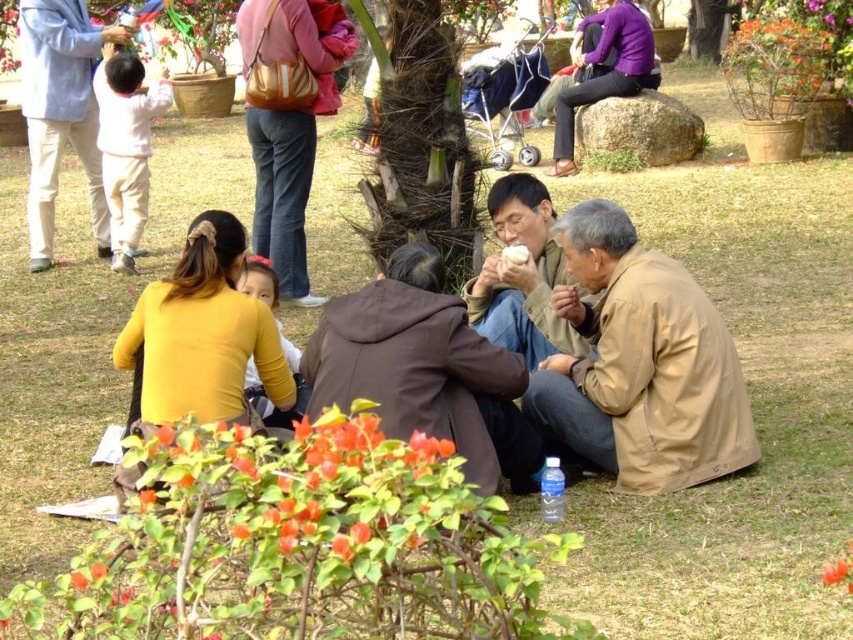
Between brown suede jacket at center and brown leather jacket at center, which one has less height?

With less height is brown leather jacket at center.

Locate an element on the screen. Image resolution: width=853 pixels, height=640 pixels. brown suede jacket at center is located at coordinates (424, 371).

Identify the location of brown suede jacket at center. (424, 371).

Measure the distance between brown textured tree trunk at center and pink fabric purse at upper center.

A distance of 1.67 meters exists between brown textured tree trunk at center and pink fabric purse at upper center.

Is point (407, 0) positioned before point (312, 29)?

Yes, point (407, 0) is closer to viewer.

Between point (357, 230) and point (280, 156), which one is positioned in front?

Point (357, 230) is more forward.

Where is `brown textured tree trunk at center`? brown textured tree trunk at center is located at coordinates (421, 141).

Where is `pink fabric purse at upper center`? The image size is (853, 640). pink fabric purse at upper center is located at coordinates (288, 120).

Can you confirm if pink fabric purse at upper center is smaller than orange matte flower at lower center?

No, pink fabric purse at upper center is not smaller than orange matte flower at lower center.

From the picture: Who is more forward, [308,160] or [93,564]?

Positioned in front is point [93,564].

The image size is (853, 640). I want to click on pink fabric purse at upper center, so click(288, 120).